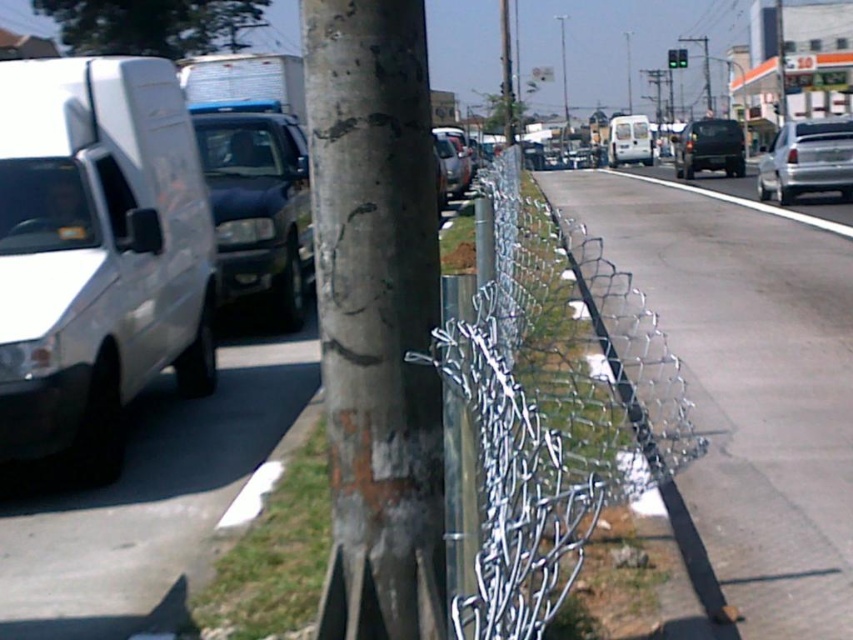
Question: Which point appears closest to the camera in this image?

Choices:
 (A) (811, 186)
 (B) (219, 260)

Answer: (B)

Question: Which point is closer to the camera?

Choices:
 (A) white matte van at left
 (B) metallic chain-link fence at center
 (C) metallic chain-link fence at center-right

Answer: (C)

Question: Does matte black truck at left have a greater width compared to white glossy truck at upper right?

Choices:
 (A) yes
 (B) no

Answer: (B)

Question: Which point is farther to the camera?

Choices:
 (A) [x=726, y=140]
 (B) [x=631, y=141]
 (C) [x=781, y=150]
 (D) [x=410, y=4]

Answer: (B)

Question: Does metallic chain-link fence at center-right appear on the left side of white matte van at center?

Choices:
 (A) no
 (B) yes

Answer: (B)

Question: Can you confirm if white matte van at left is wider than matte black truck at left?

Choices:
 (A) yes
 (B) no

Answer: (A)